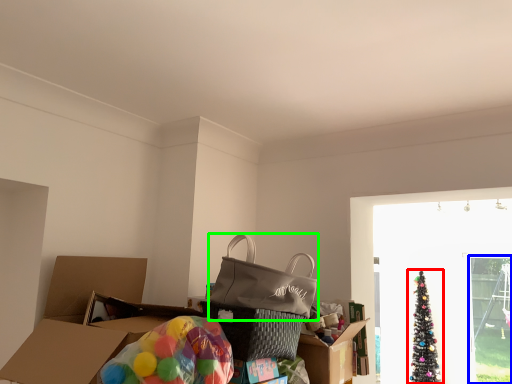
Question: Estimate the real-world distances between objects in this image. Which object is closer to christmas tree (highlighted by a red box), screen door (highlighted by a blue box) or pack (highlighted by a green box)?

Choices:
 (A) screen door
 (B) pack

Answer: (A)